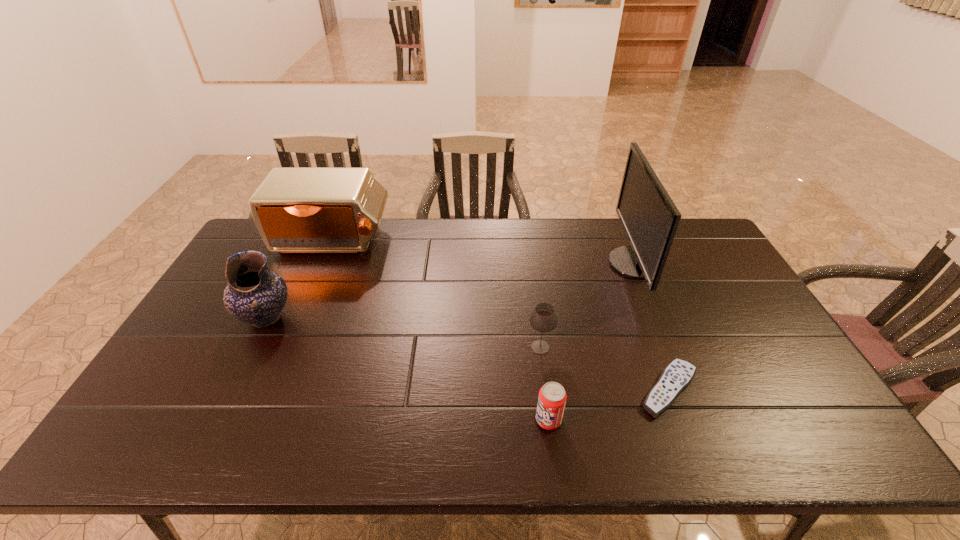
Where is `free region located on the front of the pottery`? free region located on the front of the pottery is located at coordinates (228, 394).

Where is `free space located on the right of the fourth tallest object`? This screenshot has height=540, width=960. free space located on the right of the fourth tallest object is located at coordinates (x=622, y=347).

Identify the location of free region located 0.250m on the surface of the soda can. point(430,420).

The height and width of the screenshot is (540, 960). I want to click on vacant region located 0.150m on the surface of the soda can, so click(472, 420).

The height and width of the screenshot is (540, 960). What are the coordinates of `vacant point located 0.340m on the surface of the soda can` in the screenshot? It's located at (392, 420).

Identify the location of vacant space situated on the left of the remote control. The height and width of the screenshot is (540, 960). (612, 390).

This screenshot has height=540, width=960. I want to click on monitor present at the far edge, so click(649, 217).

Where is `toaster oven that is at the far edge`? The height and width of the screenshot is (540, 960). toaster oven that is at the far edge is located at coordinates (296, 210).

Identify the location of object at the near edge. (552, 397).

This screenshot has width=960, height=540. I want to click on toaster oven situated at the left edge, so point(296,210).